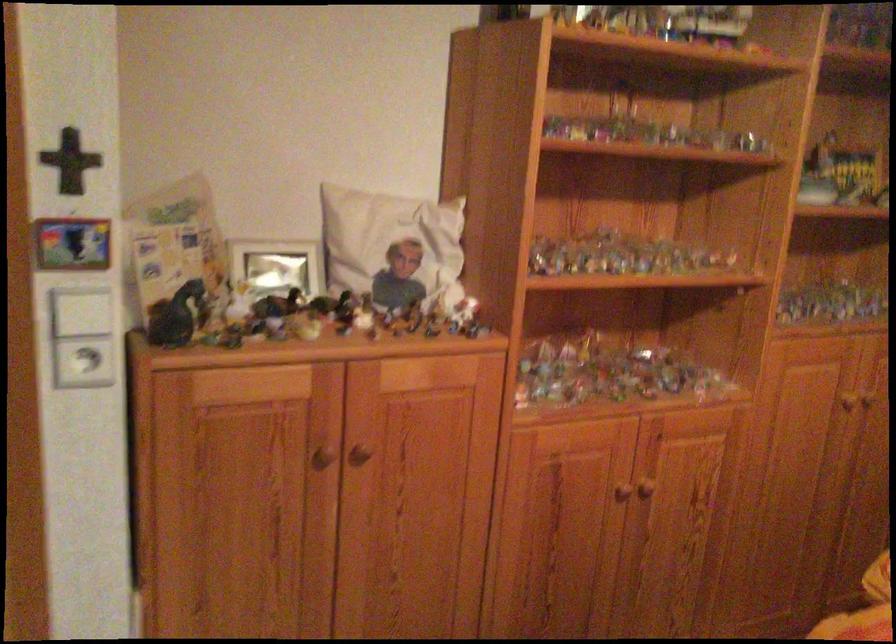
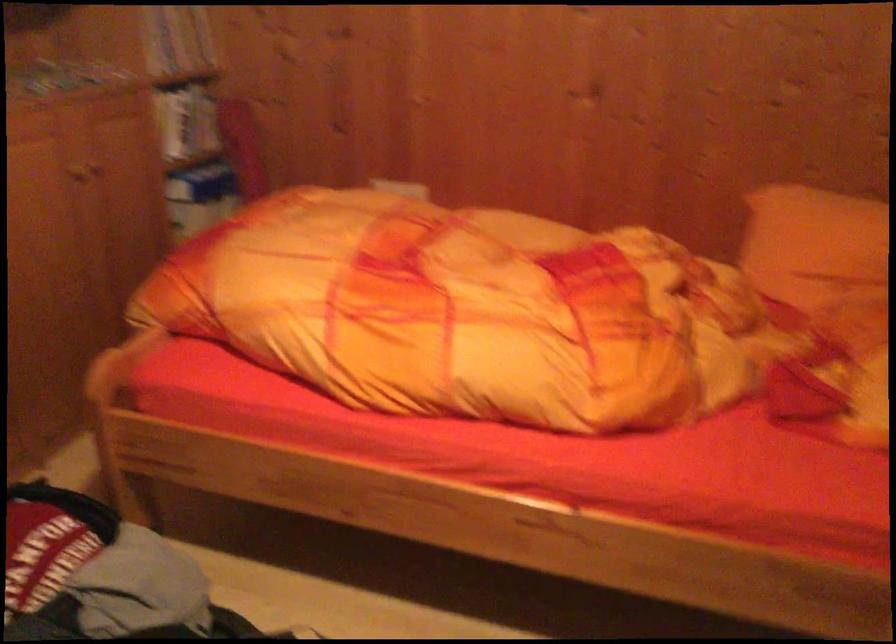
The images are taken continuously from a first-person perspective. In which direction is your viewpoint rotating?

The rotation direction of the camera is right-down.